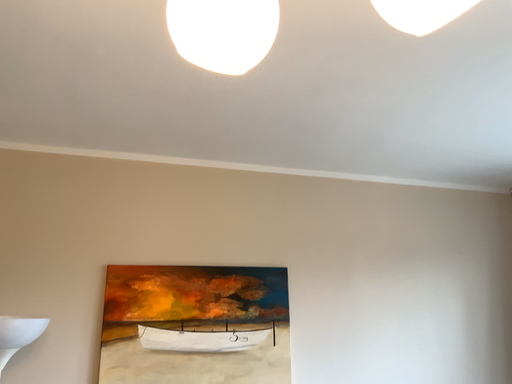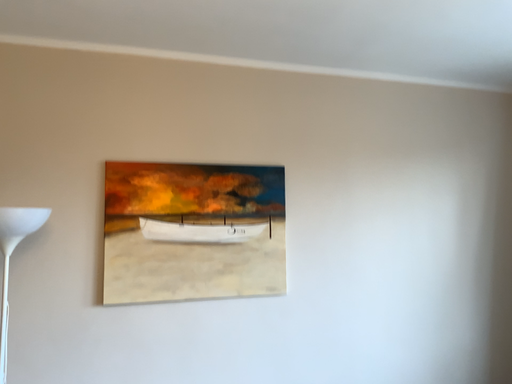
Question: How did the camera likely rotate when shooting the video?

Choices:
 (A) rotated downward
 (B) rotated upward

Answer: (A)